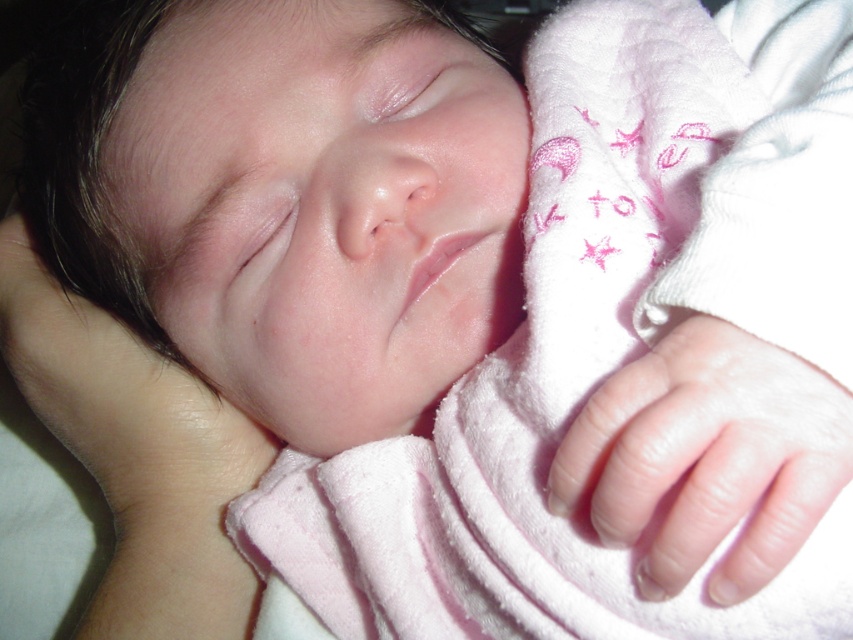
Is point (413, 90) positioned behind point (213, 438)?

That is False.

Who is more distant from viewer, [206,99] or [6,294]?

The point [6,294] is behind.

Does point (140, 156) come in front of point (90, 456)?

Yes, point (140, 156) is in front of point (90, 456).

Where is `smooth skin baby at center`? smooth skin baby at center is located at coordinates (287, 198).

Which is more to the left, smooth skin hand at lower right or smooth skin hand at lower left?

From the viewer's perspective, smooth skin hand at lower left appears more on the left side.

Does smooth skin hand at lower right appear over smooth skin hand at lower left?

Incorrect, smooth skin hand at lower right is not positioned above smooth skin hand at lower left.

Between point (641, 365) and point (177, 380), which one is positioned in front?

Point (641, 365) is in front.

Find the location of `smooth skin hand at lower right`. smooth skin hand at lower right is located at coordinates (706, 456).

Is point (665, 60) positioned behind point (648, 378)?

Yes, point (665, 60) is behind point (648, 378).

Who is lower down, pink soft blanket at center or smooth skin hand at lower right?

Positioned lower is smooth skin hand at lower right.

Does point (802, 67) come in front of point (630, 442)?

No, it is behind (630, 442).

At what (x,y) coordinates should I click in order to perform the action: click on pink soft blanket at center. Please return your answer as a coordinate pair (x, y). Image resolution: width=853 pixels, height=640 pixels. Looking at the image, I should click on (601, 339).